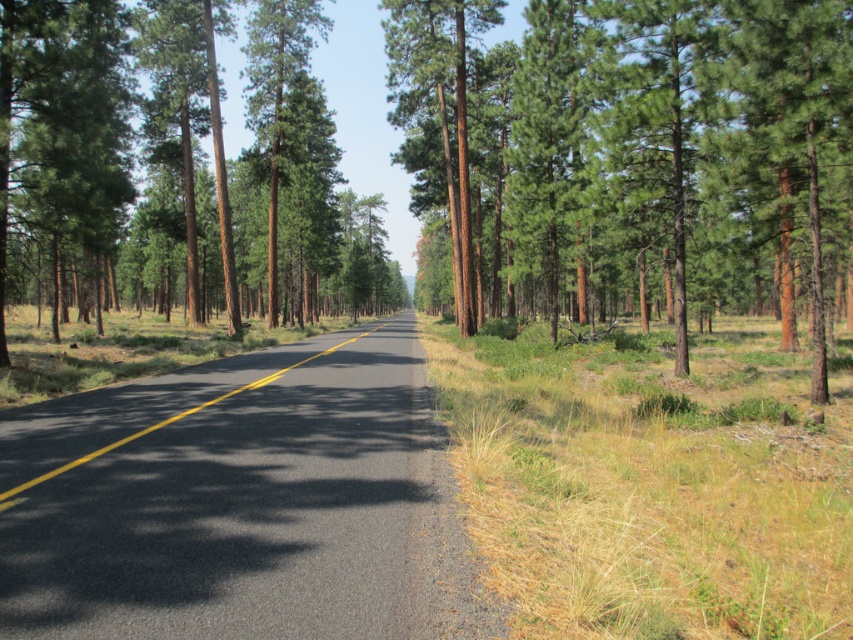
Question: Can you confirm if green rough bark tree at center is positioned to the right of black asphalt road at center?

Choices:
 (A) yes
 (B) no

Answer: (A)

Question: Does green rough bark tree at center have a smaller size compared to black asphalt road at center?

Choices:
 (A) no
 (B) yes

Answer: (A)

Question: Which object appears closest to the camera in this image?

Choices:
 (A) green rough bark tree at center
 (B) black asphalt road at center

Answer: (B)

Question: Is green rough bark tree at center positioned at the back of black asphalt road at center?

Choices:
 (A) yes
 (B) no

Answer: (A)

Question: Which of the following is the farthest from the observer?

Choices:
 (A) (45, 476)
 (B) (489, 76)

Answer: (B)